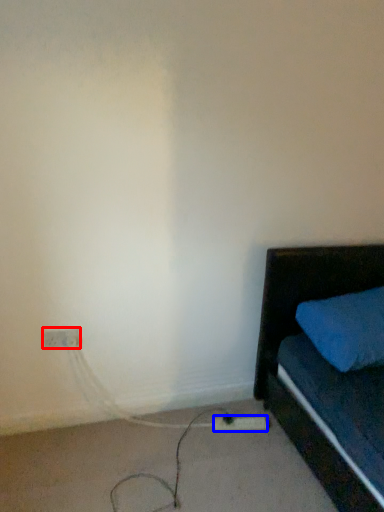
Question: Which object appears closest to the camera in this image, electric outlet (highlighted by a red box) or extension cord (highlighted by a blue box)?

Choices:
 (A) electric outlet
 (B) extension cord

Answer: (A)